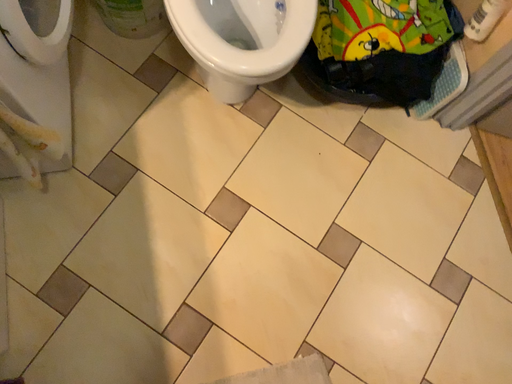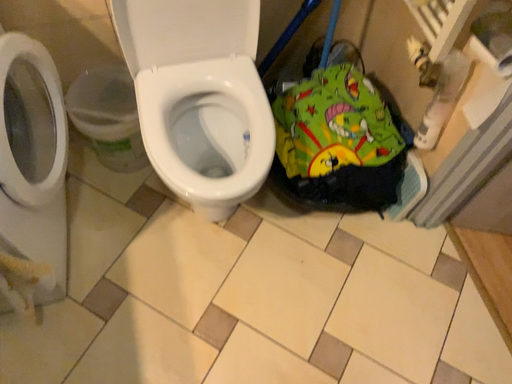
Question: Which way did the camera rotate in the video?

Choices:
 (A) rotated downward
 (B) rotated upward

Answer: (B)